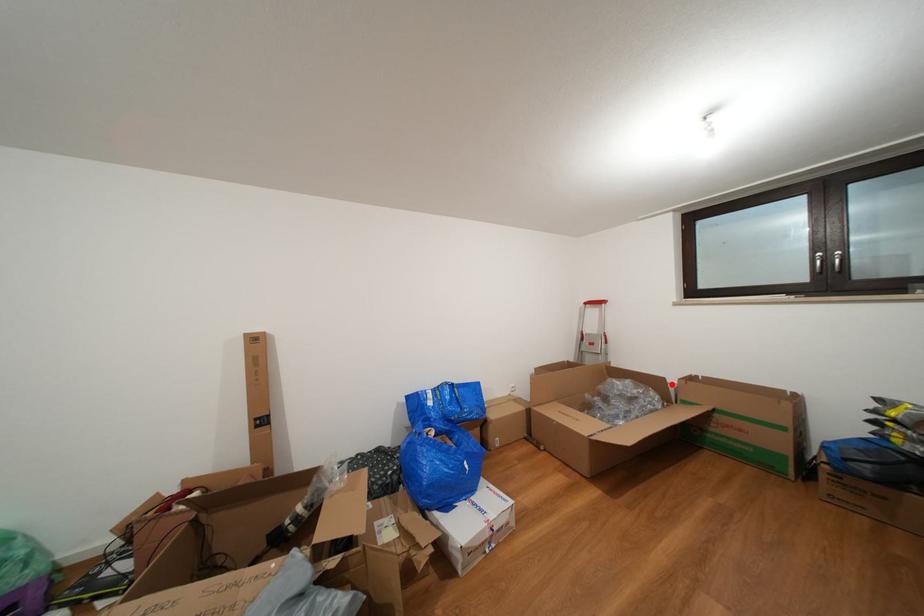
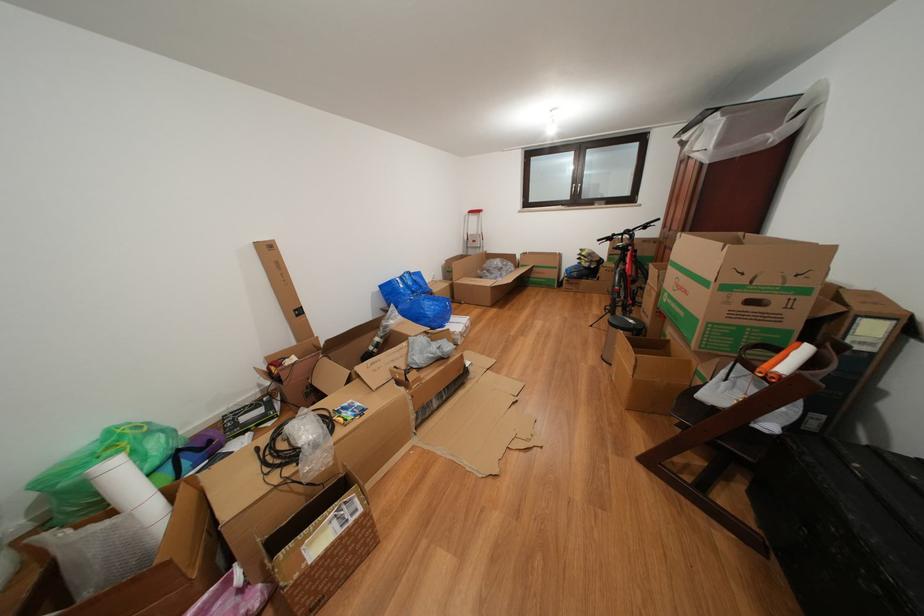
Find the pixel in the second image that matches the highlighted location in the first image.

(523, 261)